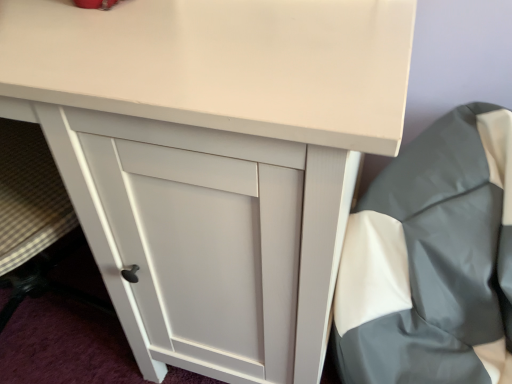
Where is `gray/white fabric at right`? gray/white fabric at right is located at coordinates (432, 260).

Describe the element at coordinates (432, 260) in the screenshot. I see `gray/white fabric at right` at that location.

Locate an element on the screen. Image resolution: width=512 pixels, height=384 pixels. gray/white fabric at right is located at coordinates (432, 260).